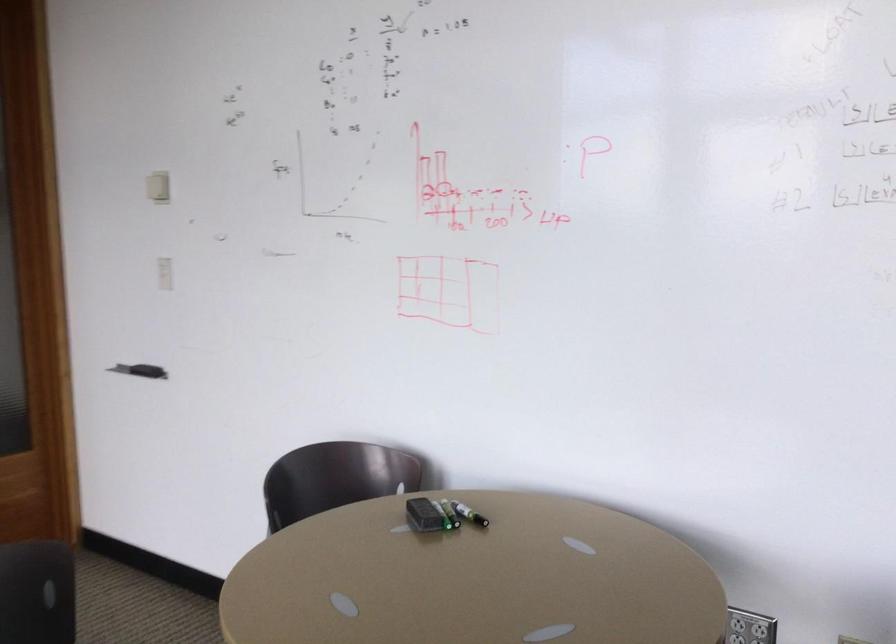
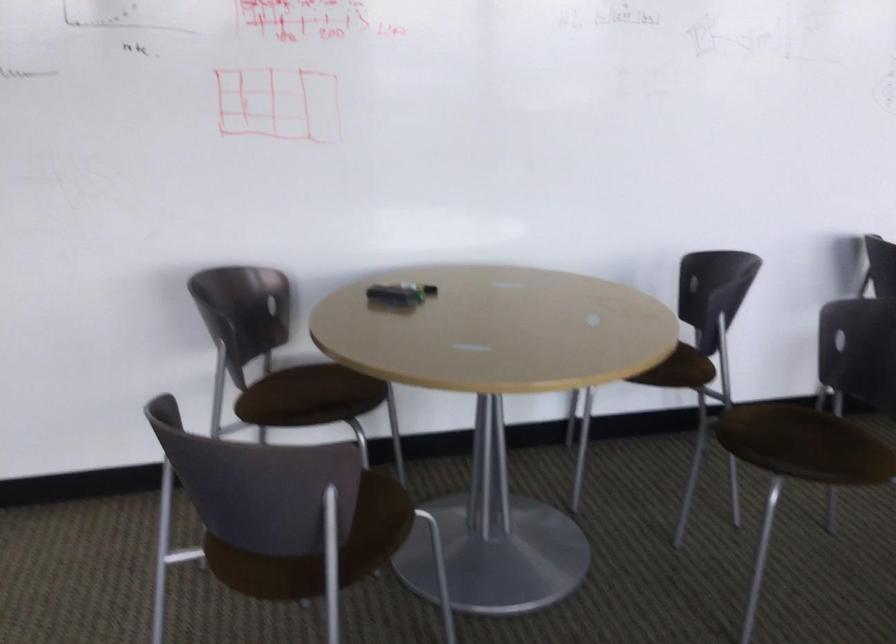
Find the pixel in the second image that matches pixel 495 526 in the first image.

(433, 290)